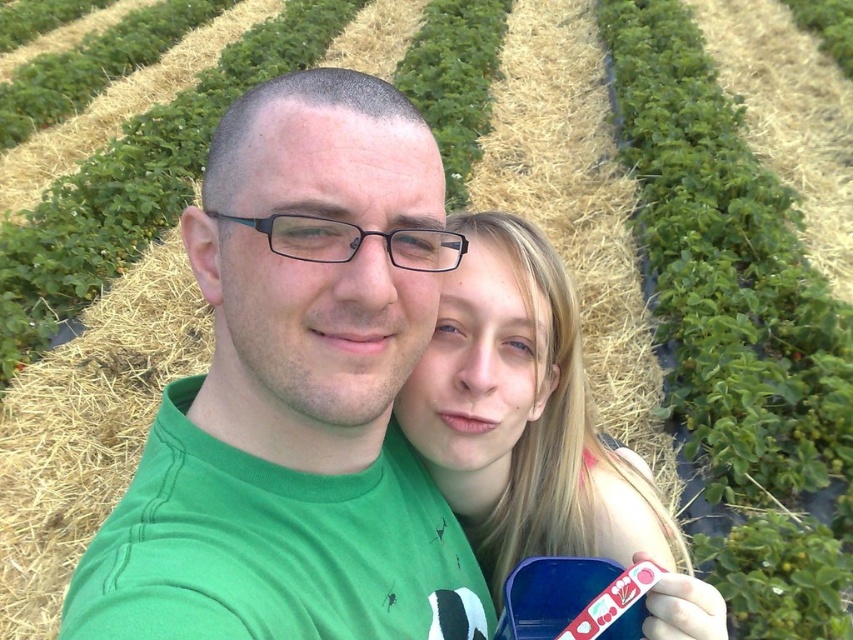
Who is positioned more to the left, green matte t-shirt at center or blonde hair at center?

green matte t-shirt at center is more to the left.

Between point (433, 186) and point (491, 365), which one is positioned behind?

Point (491, 365)

Which is behind, point (357, 484) or point (624, 492)?

Positioned behind is point (624, 492).

Where is `green matte t-shirt at center`? The width and height of the screenshot is (853, 640). green matte t-shirt at center is located at coordinates (294, 337).